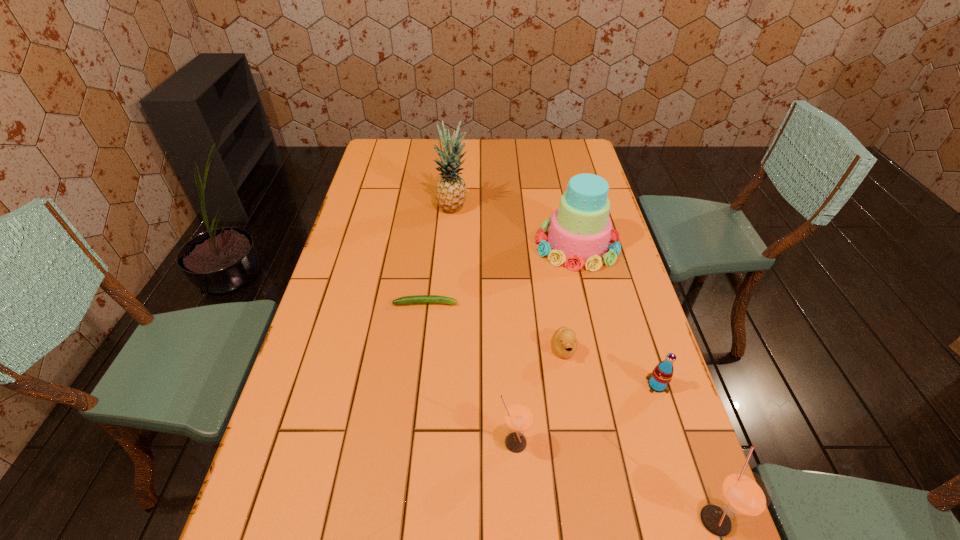
Identify the location of free region at the left edge of the desktop. (354, 238).

You are a GUI agent. You are given a task and a screenshot of the screen. Output one action in this format:
    pyautogui.click(x=<x>, y=<y>)
    Task: Click on the vacant space at the right edge of the desktop
    This screenshot has width=960, height=540.
    Given the screenshot: What is the action you would take?
    pyautogui.click(x=581, y=288)

The image size is (960, 540). I want to click on blank space at the far left corner of the desktop, so click(389, 152).

Where is `free space at the far right corner`? free space at the far right corner is located at coordinates (559, 144).

Locate an element on the screen. vacant area that lies between the soda and the third farthest object is located at coordinates (541, 344).

Identify the location of vacant space that is in between the sixth nearest object and the second shortest object. (570, 296).

The width and height of the screenshot is (960, 540). Find the location of `blank region between the second farthest object and the zucchini`. blank region between the second farthest object and the zucchini is located at coordinates (501, 274).

The height and width of the screenshot is (540, 960). I want to click on free space that is in between the third shortest object and the third farthest object, so click(541, 344).

You are a GUI agent. You are given a task and a screenshot of the screen. Output one action in this format:
    pyautogui.click(x=<x>, y=<y>)
    Task: Click on the vacant space in between the soda and the pineapple
    The height and width of the screenshot is (540, 960).
    Given the screenshot: What is the action you would take?
    pyautogui.click(x=555, y=297)

Locate an element on the screen. free space between the third shortest object and the shorter straw is located at coordinates (586, 414).